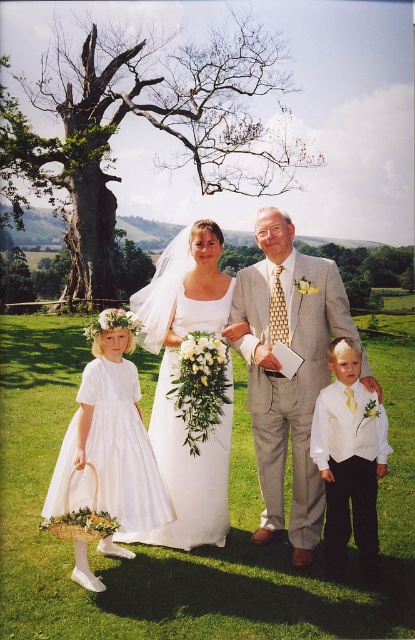
Question: Which point is farther from the camera taking this photo?

Choices:
 (A) (197, 483)
 (B) (273, 486)

Answer: (B)

Question: From the image, what is the correct spatial relationship of white satin dress at center in relation to white satin dress at lower left?

Choices:
 (A) above
 (B) below

Answer: (A)

Question: Which point is closer to the camera?

Choices:
 (A) (71, 461)
 (B) (173, 538)

Answer: (A)

Question: Does white satin wedding dress at center have a lesser width compared to white satin vest at lower right?

Choices:
 (A) yes
 (B) no

Answer: (B)

Question: Among these objects, which one is nearest to the camera?

Choices:
 (A) white satin vest at lower right
 (B) light gray textured suit at center
 (C) white satin dress at lower left

Answer: (C)

Question: Does white satin wedding dress at center have a greater width compared to white satin vest at lower right?

Choices:
 (A) yes
 (B) no

Answer: (A)